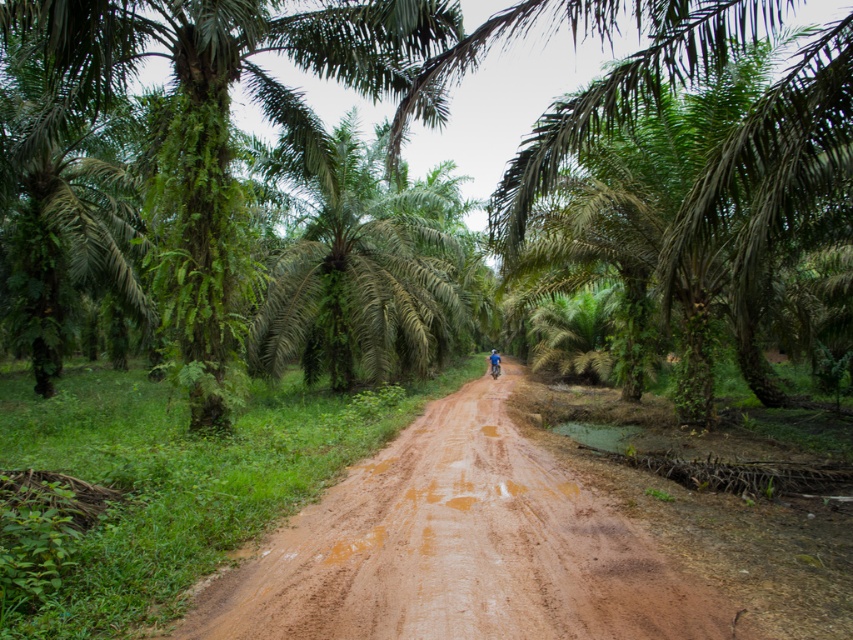
Question: Does green leafy palm tree at left appear on the right side of green leafy palm tree at center?

Choices:
 (A) no
 (B) yes

Answer: (A)

Question: Is green leafy palm tree at left to the left of blue fabric helmet at center from the viewer's perspective?

Choices:
 (A) yes
 (B) no

Answer: (A)

Question: Does brown sandy dirt track at center have a lesser width compared to green leafy palm tree at left?

Choices:
 (A) yes
 (B) no

Answer: (A)

Question: Which of the following is the farthest from the observer?

Choices:
 (A) green leafy palm tree at center
 (B) brown sandy dirt track at center
 (C) green leafy palm tree at left

Answer: (A)

Question: Which is farther from the green leafy palm tree at center?

Choices:
 (A) brown sandy dirt track at center
 (B) green leafy palm tree at left
 (C) blue fabric helmet at center

Answer: (C)

Question: Which point appears closest to the camera in this image?

Choices:
 (A) (320, 253)
 (B) (619, 616)
 (C) (239, 285)

Answer: (B)